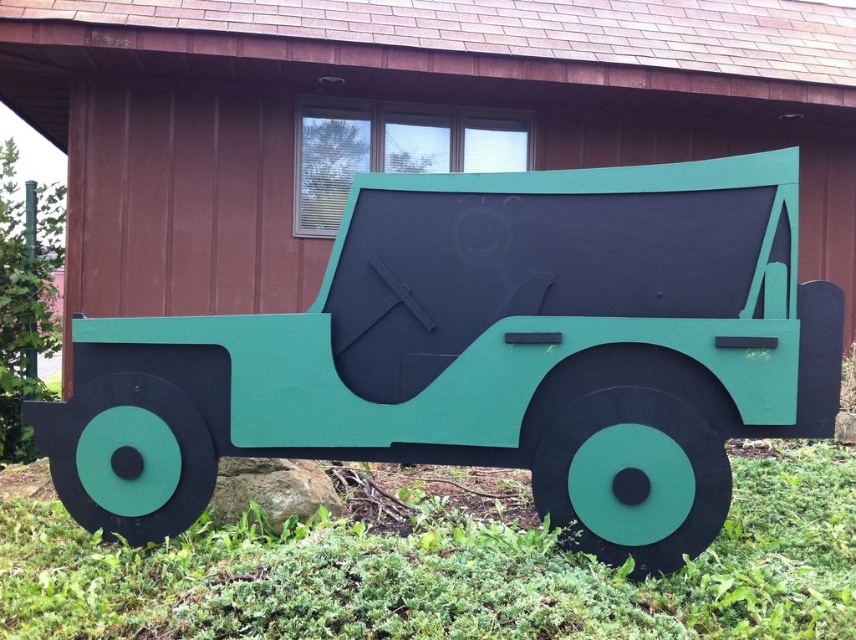
Question: Which object is positioned farthest from the green matte grass at lower center?

Choices:
 (A) matte green jeep at center
 (B) green matte jeep at center

Answer: (B)

Question: Estimate the real-world distances between objects in this image. Which object is farther from the matte green jeep at center?

Choices:
 (A) green matte grass at lower center
 (B) green matte jeep at center

Answer: (B)

Question: Is matte green jeep at center positioned behind green matte jeep at center?

Choices:
 (A) no
 (B) yes

Answer: (A)

Question: Which point is farther from the camera taking this photo?

Choices:
 (A) (738, 372)
 (B) (483, 93)
 (C) (724, 572)

Answer: (B)

Question: Is green matte jeep at center to the right of green matte grass at lower center from the viewer's perspective?

Choices:
 (A) yes
 (B) no

Answer: (B)

Question: Can you confirm if matte green jeep at center is positioned to the right of green matte jeep at center?

Choices:
 (A) yes
 (B) no

Answer: (A)